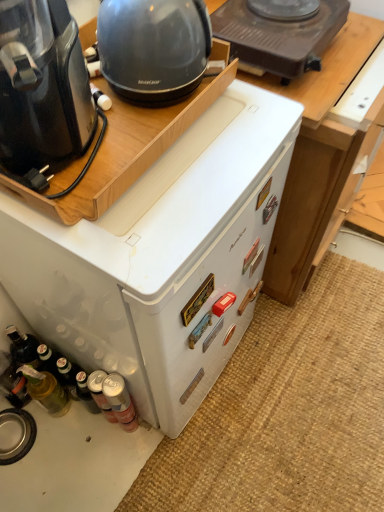
Locate an element on the screen. The width and height of the screenshot is (384, 512). free point in front of metallic silver can at lower left, the 3th bottle viewed from the left is located at coordinates (124, 476).